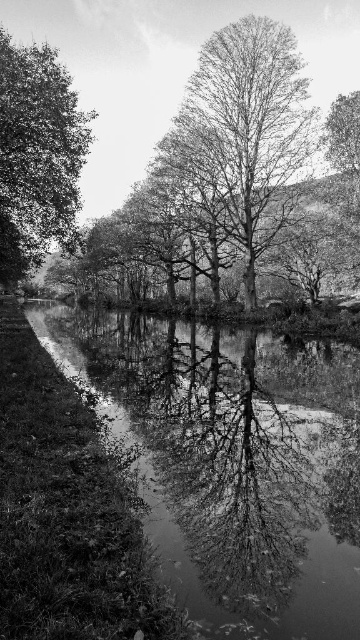
You are an environmental scientist analyzing the image. You need to determine which tree is shorter between the bare wood tree at center and the dark green leafy tree at left. Which one is shorter?

The bare wood tree at center is shorter than the dark green leafy tree at left.